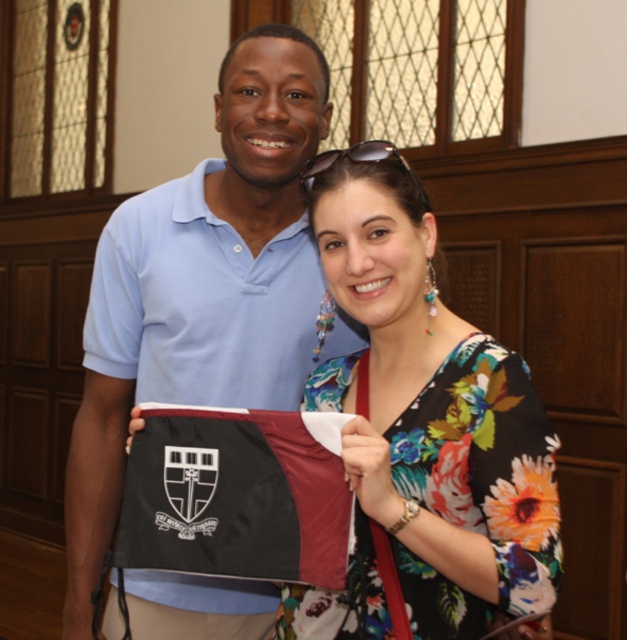
Can you confirm if floral fabric dress at center is taller than black fabric flag at center?

Indeed, floral fabric dress at center has a greater height compared to black fabric flag at center.

Can you confirm if floral fabric dress at center is positioned above black fabric flag at center?

Indeed, floral fabric dress at center is positioned over black fabric flag at center.

Where is `floral fabric dress at center`? floral fabric dress at center is located at coordinates (423, 433).

Can you confirm if light blue cotton polo shirt at center is taller than black fabric flag at center?

Yes, light blue cotton polo shirt at center is taller than black fabric flag at center.

This screenshot has height=640, width=627. Describe the element at coordinates (201, 285) in the screenshot. I see `light blue cotton polo shirt at center` at that location.

Which is in front, point (298, 244) or point (273, 420)?

Point (273, 420) is in front.

Find the location of a particular element. light blue cotton polo shirt at center is located at coordinates (201, 285).

Image resolution: width=627 pixels, height=640 pixels. What do you see at coordinates (201, 285) in the screenshot? I see `light blue cotton polo shirt at center` at bounding box center [201, 285].

In the scene shown: Between light blue cotton polo shirt at center and floral fabric dress at center, which one has less height?

floral fabric dress at center is shorter.

Which is behind, point (208, 580) or point (450, 481)?

Point (208, 580)

Find the location of a particular element. This screenshot has width=627, height=640. light blue cotton polo shirt at center is located at coordinates (201, 285).